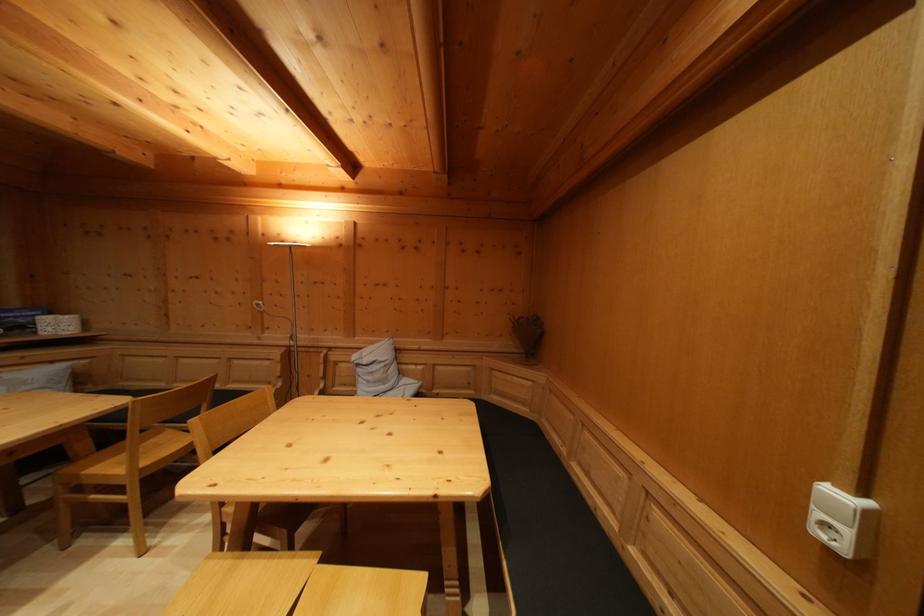
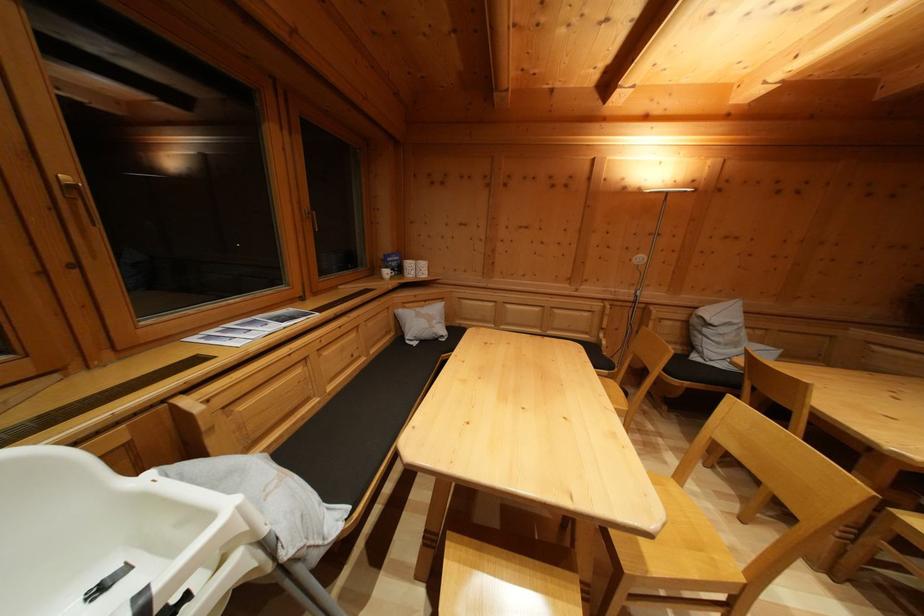
Find the pixel in the second image that matches the point at 363,377 in the first image.

(711, 337)